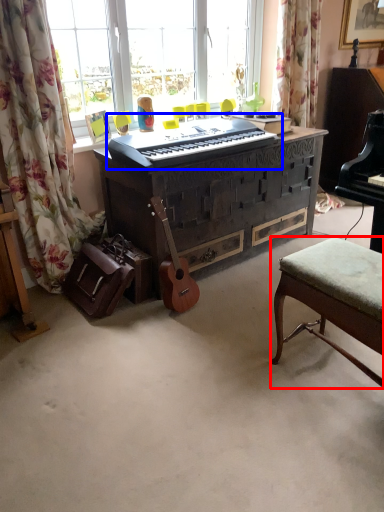
Question: Which object is further to the camera taking this photo, stool (highlighted by a red box) or musical keyboard (highlighted by a blue box)?

Choices:
 (A) stool
 (B) musical keyboard

Answer: (B)